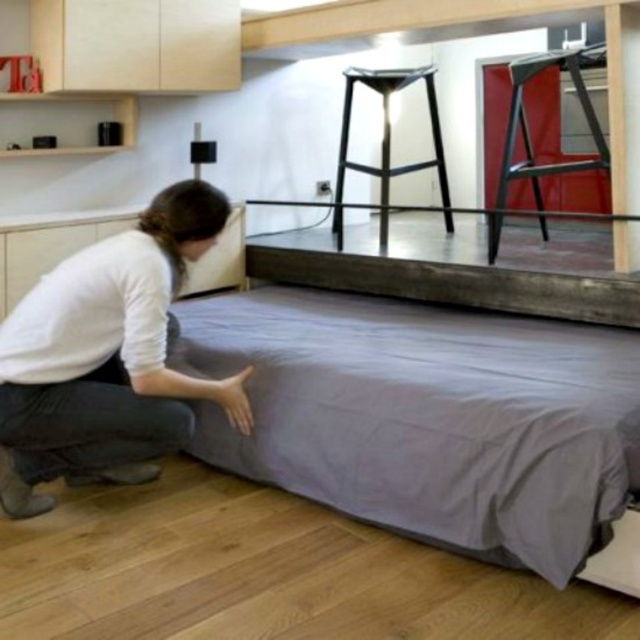
You are a delivery person who needs to place a new pillow that is 2 feet wide between the gray fabric mattress at lower center and the metallic black stool at upper center. Is there enough space to fit the pillow between them?

The distance between the gray fabric mattress at lower center and the metallic black stool at upper center is 3.71 feet. Since the pillow is 2 feet wide, there is sufficient space to place it between them as the distance is greater than the pillow width.

You are standing in the bedroom and want to pick up the white cotton shirt at lower left and the metallic black stool at upper center. Which object is easier to reach without moving your position?

The white cotton shirt at lower left is closer to the viewer than the metallic black stool at upper center, so it is easier to reach without moving your position.

You are standing in the bedroom and want to move from the gray fabric mattress at lower center to the metallic stool at upper center. Which direction should you move to reach the stool?

The gray fabric mattress at lower center is in front of the metallic stool at upper center, so to reach the stool, you should move backward away from the mattress towards the upper part of the room.